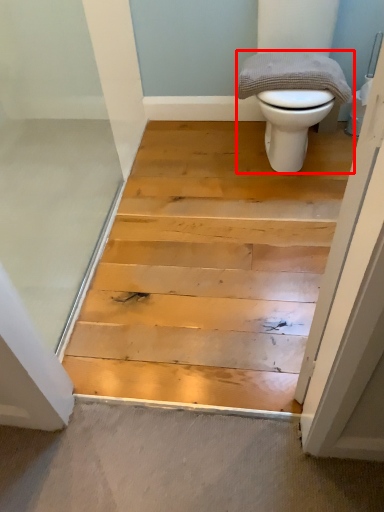
Question: In this image, where is toilet (annotated by the red box) located relative to material?

Choices:
 (A) right
 (B) left

Answer: (A)